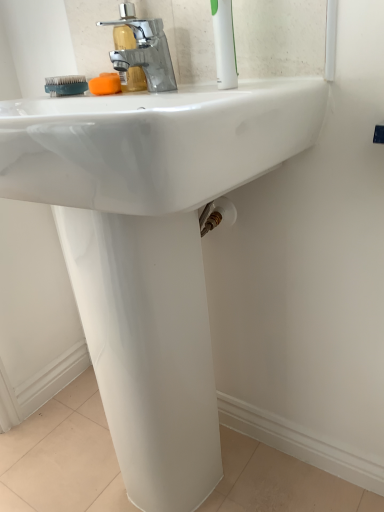
Describe the element at coordinates (105, 84) in the screenshot. I see `orange sponge at upper center` at that location.

The width and height of the screenshot is (384, 512). What are the coordinates of `white plastic toothbrush at upper right` in the screenshot? It's located at (224, 44).

The image size is (384, 512). What do you see at coordinates (141, 51) in the screenshot? I see `polished chrome faucet at upper center` at bounding box center [141, 51].

Locate an element on the screen. polished chrome faucet at upper center is located at coordinates (141, 51).

What do you see at coordinates (66, 85) in the screenshot? Image resolution: width=384 pixels, height=512 pixels. I see `teal rubber brush at upper left` at bounding box center [66, 85].

The image size is (384, 512). I want to click on orange sponge at upper center, so click(x=105, y=84).

This screenshot has height=512, width=384. I want to click on brush lying behind the polished chrome faucet at upper center, so coord(66,85).

Is teal rubber brush at upper left to the left of polished chrome faucet at upper center from the viewer's perspective?

Indeed, teal rubber brush at upper left is positioned on the left side of polished chrome faucet at upper center.

Considering the positions of point (62, 81) and point (172, 87), is point (62, 81) closer or farther from the camera than point (172, 87)?

Point (62, 81) is positioned farther from the camera compared to point (172, 87).

Can you tell me how much teal rubber brush at upper left and polished chrome faucet at upper center differ in facing direction?

teal rubber brush at upper left and polished chrome faucet at upper center are facing 1.06 degrees away from each other.

Is orange sponge at upper center positioned behind teal rubber brush at upper left?

No, it is not.

Locate an element on the screen. The image size is (384, 512). brush above the orange sponge at upper center (from a real-world perspective) is located at coordinates (66, 85).

Is teal rubber brush at upper left surrounded by orange sponge at upper center?

No, orange sponge at upper center does not contain teal rubber brush at upper left.

Is point (104, 80) closer or farther from the camera than point (64, 85)?

Point (104, 80) is closer to the camera than point (64, 85).

In the scene shown: Can you confirm if orange sponge at upper center is smaller than polished chrome faucet at upper center?

Indeed, orange sponge at upper center has a smaller size compared to polished chrome faucet at upper center.

Consider the image. Is orange sponge at upper center closer to the viewer compared to polished chrome faucet at upper center?

No, orange sponge at upper center is behind polished chrome faucet at upper center.

Does point (102, 85) come behind point (131, 76)?

Yes, it is.

Looking at the image, does white plastic toothbrush at upper right seem bigger or smaller compared to polished chrome faucet at upper center?

Considering their sizes, white plastic toothbrush at upper right takes up less space than polished chrome faucet at upper center.

Can we say white plastic toothbrush at upper right lies outside polished chrome faucet at upper center?

That's correct, white plastic toothbrush at upper right is outside of polished chrome faucet at upper center.

Considering the positions of points (221, 16) and (170, 66), is point (221, 16) closer to camera compared to point (170, 66)?

Yes, point (221, 16) is closer to viewer.

Considering the sizes of white plastic toothbrush at upper right and polished chrome faucet at upper center in the image, is white plastic toothbrush at upper right wider or thinner than polished chrome faucet at upper center?

In the image, white plastic toothbrush at upper right appears to be more narrow than polished chrome faucet at upper center.

Locate an element on the screen. The width and height of the screenshot is (384, 512). tap in front of the orange sponge at upper center is located at coordinates (141, 51).

Considering the sizes of objects polished chrome faucet at upper center and orange sponge at upper center in the image provided, who is bigger, polished chrome faucet at upper center or orange sponge at upper center?

polished chrome faucet at upper center is bigger.

From the image's perspective, is polished chrome faucet at upper center beneath orange sponge at upper center?

No, from the image's perspective, polished chrome faucet at upper center is not beneath orange sponge at upper center.

Which is more to the right, polished chrome faucet at upper center or orange sponge at upper center?

polished chrome faucet at upper center.

From a real-world perspective, does polished chrome faucet at upper center sit lower than white plastic toothbrush at upper right?

Yes, from a real-world perspective, polished chrome faucet at upper center is under white plastic toothbrush at upper right.

From the picture: Is polished chrome faucet at upper center positioned with its back to white plastic toothbrush at upper right?

No, polished chrome faucet at upper center is not facing the opposite direction of white plastic toothbrush at upper right.

Is polished chrome faucet at upper center next to white plastic toothbrush at upper right and touching it?

No.

Is polished chrome faucet at upper center at the right side of white plastic toothbrush at upper right?

No.

At what (x,y) coordinates should I click in order to perform the action: click on brush below the white plastic toothbrush at upper right (from the image's perspective). Please return your answer as a coordinate pair (x, y). This screenshot has height=512, width=384. Looking at the image, I should click on (66, 85).

Is teal rubber brush at upper left with white plastic toothbrush at upper right?

No, teal rubber brush at upper left is not with white plastic toothbrush at upper right.

Is teal rubber brush at upper left positioned beyond the bounds of white plastic toothbrush at upper right?

Absolutely, teal rubber brush at upper left is external to white plastic toothbrush at upper right.

Considering the points (79, 83) and (234, 56), which point is behind, point (79, 83) or point (234, 56)?

The point (79, 83) is behind.

Identify the location of tap located above the teal rubber brush at upper left (from the image's perspective). (141, 51).

Image resolution: width=384 pixels, height=512 pixels. I want to click on brush behind the orange sponge at upper center, so click(x=66, y=85).

From the image, which object appears to be farther from white plastic toothbrush at upper right, teal rubber brush at upper left or orange sponge at upper center?

Based on the image, teal rubber brush at upper left appears to be further to white plastic toothbrush at upper right.

From the image, which object appears to be farther from orange sponge at upper center, teal rubber brush at upper left or polished chrome faucet at upper center?

teal rubber brush at upper left is further to orange sponge at upper center.

Based on the photo, based on their spatial positions, is white plastic toothbrush at upper right or orange sponge at upper center closer to teal rubber brush at upper left?

orange sponge at upper center lies closer to teal rubber brush at upper left than the other object.

From the image, which object appears to be farther from white plastic toothbrush at upper right, polished chrome faucet at upper center or orange sponge at upper center?

orange sponge at upper center is positioned further to the anchor white plastic toothbrush at upper right.

When comparing their distances from white plastic toothbrush at upper right, does polished chrome faucet at upper center or teal rubber brush at upper left seem closer?

polished chrome faucet at upper center.

Considering their positions, is orange sponge at upper center positioned closer to teal rubber brush at upper left than white plastic toothbrush at upper right?

orange sponge at upper center is closer to teal rubber brush at upper left.

When comparing their distances from polished chrome faucet at upper center, does white plastic toothbrush at upper right or teal rubber brush at upper left seem closer?

The object closer to polished chrome faucet at upper center is teal rubber brush at upper left.

Looking at this image, estimate the real-world distances between objects in this image. Which object is further from polished chrome faucet at upper center, orange sponge at upper center or teal rubber brush at upper left?

teal rubber brush at upper left is positioned further to the anchor polished chrome faucet at upper center.

Locate an element on the screen. soap located between teal rubber brush at upper left and polished chrome faucet at upper center in the left-right direction is located at coordinates (105, 84).

Where is `soap located between white plastic toothbrush at upper right and teal rubber brush at upper left in the depth direction`? Image resolution: width=384 pixels, height=512 pixels. soap located between white plastic toothbrush at upper right and teal rubber brush at upper left in the depth direction is located at coordinates (105, 84).

You are a GUI agent. You are given a task and a screenshot of the screen. Output one action in this format:
    pyautogui.click(x=<x>, y=<y>)
    Task: Click on the tap between teal rubber brush at upper left and white plastic toothbrush at upper right from left to right
    
    Given the screenshot: What is the action you would take?
    pyautogui.click(x=141, y=51)

This screenshot has height=512, width=384. Find the location of `tap between white plastic toothbrush at upper right and orange sponge at upper center along the z-axis`. tap between white plastic toothbrush at upper right and orange sponge at upper center along the z-axis is located at coordinates (141, 51).